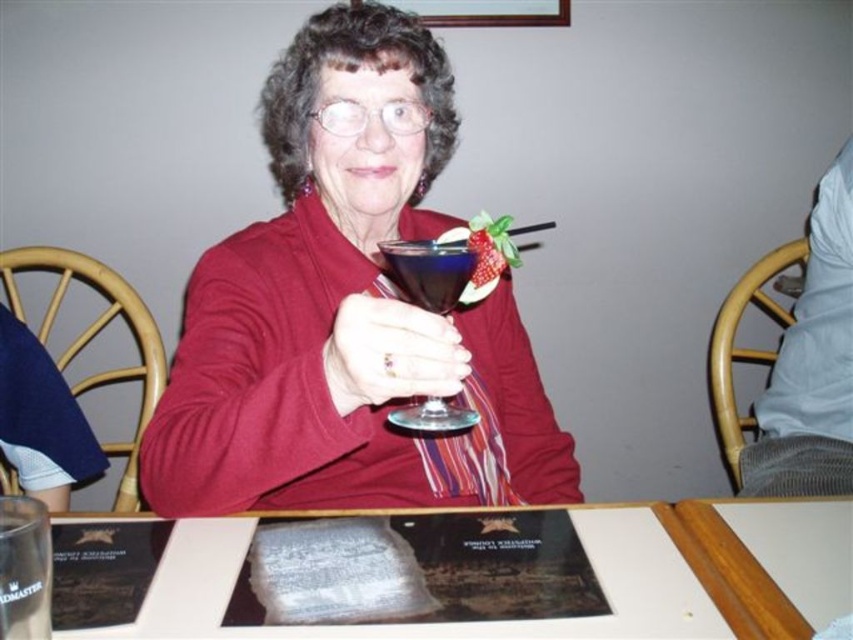
You are a waiter in a restaurant. You need to place a small plate of appetizers between the wooden table at center and the transparent glass at center. Based on their positions, where should you place the appetizers?

The wooden table at center is in front of the transparent glass at center, so you should place the appetizers on the wooden table at center since it is closer to the customer.

You are a waiter in a restaurant. You need to place a new menu on the table so that it is visible to the customer sitting at the table. Where should you place the menu relative to the matte glass at center and the wooden table at center?

The wooden table at center is behind matte glass at center, so you should place the menu on the wooden table at center in front of the matte glass at center to ensure it is visible to the customer.